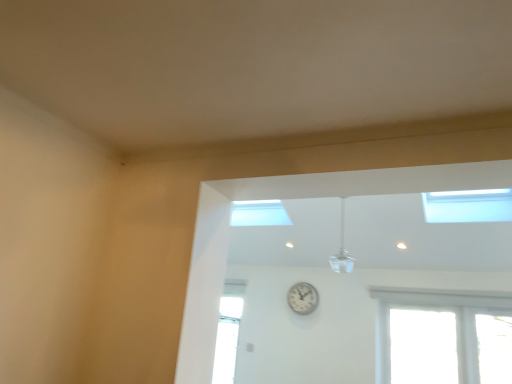
Image resolution: width=512 pixels, height=384 pixels. Find the location of `white glossy ceiling fan at upper center`. white glossy ceiling fan at upper center is located at coordinates (342, 249).

What is the approximate height of white glossy ceiling fan at upper center?

white glossy ceiling fan at upper center is 66.99 centimeters tall.

Locate an element on the screen. This screenshot has width=512, height=384. transparent glass window at upper right is located at coordinates (468, 206).

Looking at this image, what is the approximate width of white metallic clock at center?

white metallic clock at center is 3.52 inches wide.

Where is `white glossy ceiling fan at upper center`? Image resolution: width=512 pixels, height=384 pixels. white glossy ceiling fan at upper center is located at coordinates (342, 249).

Who is shorter, white metallic clock at center or white glossy ceiling fan at upper center?

white metallic clock at center.

At what (x,y) coordinates should I click in order to perform the action: click on light fixture in front of the white metallic clock at center. Please return your answer as a coordinate pair (x, y). Image resolution: width=512 pixels, height=384 pixels. Looking at the image, I should click on (342, 249).

Does white metallic clock at center have a greater width compared to white glossy ceiling fan at upper center?

Incorrect, the width of white metallic clock at center does not surpass that of white glossy ceiling fan at upper center.

Which is in front, point (291, 300) or point (345, 252)?

The point (345, 252) is in front.

Is the surface of transparent glass window at upper right in direct contact with white glossy ceiling fan at upper center?

No.

Is point (471, 190) positioned behind point (334, 257)?

That is False.

Is transparent glass window at upper right facing away from white glossy ceiling fan at upper center?

No, white glossy ceiling fan at upper center is not at the back of transparent glass window at upper right.

Is white glossy ceiling fan at upper center completely or partially inside transparent glass window at upper right?

No, white glossy ceiling fan at upper center is not surrounded by transparent glass window at upper right.

Between transparent glass window at upper right and white metallic clock at center, which one has larger size?

Bigger between the two is transparent glass window at upper right.

Considering the relative sizes of transparent glass window at upper right and white metallic clock at center in the image provided, is transparent glass window at upper right wider than white metallic clock at center?

Indeed, transparent glass window at upper right has a greater width compared to white metallic clock at center.

Can you tell me how much transparent glass window at upper right and white metallic clock at center differ in facing direction?

The facing directions of transparent glass window at upper right and white metallic clock at center are 4.68 degrees apart.

Is point (490, 199) positioned behind point (308, 292)?

No, it is not.

This screenshot has width=512, height=384. What are the coordinates of `window in front of the white glossy ceiling fan at upper center` in the screenshot? It's located at (468, 206).

From a real-world perspective, is white glossy ceiling fan at upper center located higher than transparent glass window at upper right?

Actually, white glossy ceiling fan at upper center is physically below transparent glass window at upper right in the real world.

Does point (343, 251) lie behind point (511, 217)?

Yes.

In the scene shown: What's the angular difference between white glossy ceiling fan at upper center and transparent glass window at upper right's facing directions?

There is a 4.69-degree angle between the facing directions of white glossy ceiling fan at upper center and transparent glass window at upper right.

Between white metallic clock at center and transparent glass window at upper right, which one has smaller width?

white metallic clock at center is thinner.

Which object is closer to the camera, white metallic clock at center or transparent glass window at upper right?

transparent glass window at upper right is in front.

Considering the points (311, 302) and (504, 191), which point is behind, point (311, 302) or point (504, 191)?

The point (311, 302) is more distant.

Is white metallic clock at center in contact with transparent glass window at upper right?

No, white metallic clock at center is not in contact with transparent glass window at upper right.

Where is `clock below the white glossy ceiling fan at upper center (from a real-world perspective)`? clock below the white glossy ceiling fan at upper center (from a real-world perspective) is located at coordinates (302, 298).

From a real-world perspective, is white glossy ceiling fan at upper center located beneath white metallic clock at center?

No, from a real-world perspective, white glossy ceiling fan at upper center is not below white metallic clock at center.

Is white metallic clock at center at the back of white glossy ceiling fan at upper center?

No, white glossy ceiling fan at upper center is not facing away from white metallic clock at center.

Between point (348, 268) and point (292, 289), which one is positioned behind?

The point (292, 289) is farther.

The height and width of the screenshot is (384, 512). I want to click on clock that appears behind the white glossy ceiling fan at upper center, so click(302, 298).

This screenshot has height=384, width=512. Identify the location of light fixture lying below the transparent glass window at upper right (from the image's perspective). (342, 249).

From the image, which object appears to be farther from white metallic clock at center, transparent glass window at upper right or white glossy ceiling fan at upper center?

transparent glass window at upper right is positioned further to the anchor white metallic clock at center.

Estimate the real-world distances between objects in this image. Which object is further from white glossy ceiling fan at upper center, white metallic clock at center or transparent glass window at upper right?

Based on the image, transparent glass window at upper right appears to be further to white glossy ceiling fan at upper center.

When comparing their distances from white glossy ceiling fan at upper center, does transparent glass window at upper right or white metallic clock at center seem further?

transparent glass window at upper right is positioned further to the anchor white glossy ceiling fan at upper center.

Based on their spatial positions, is white metallic clock at center or white glossy ceiling fan at upper center further from transparent glass window at upper right?

white metallic clock at center is positioned further to the anchor transparent glass window at upper right.

From the image, which object appears to be farther from white metallic clock at center, white glossy ceiling fan at upper center or transparent glass window at upper right?

transparent glass window at upper right lies further to white metallic clock at center than the other object.

Which object lies nearer to the anchor point transparent glass window at upper right, white glossy ceiling fan at upper center or white metallic clock at center?

white glossy ceiling fan at upper center.

I want to click on light fixture between transparent glass window at upper right and white metallic clock at center in the front-back direction, so pos(342,249).